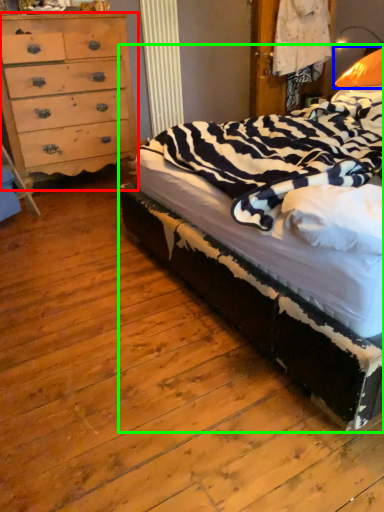
Question: Which is nearer to the chest of drawers (highlighted by a red box)? pillow (highlighted by a blue box) or bed (highlighted by a green box).

Choices:
 (A) pillow
 (B) bed

Answer: (B)